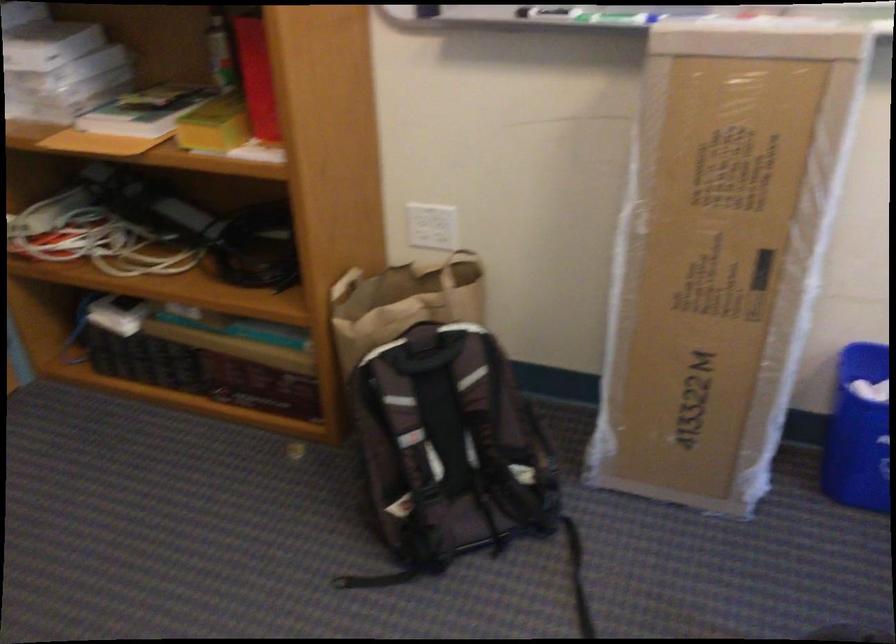
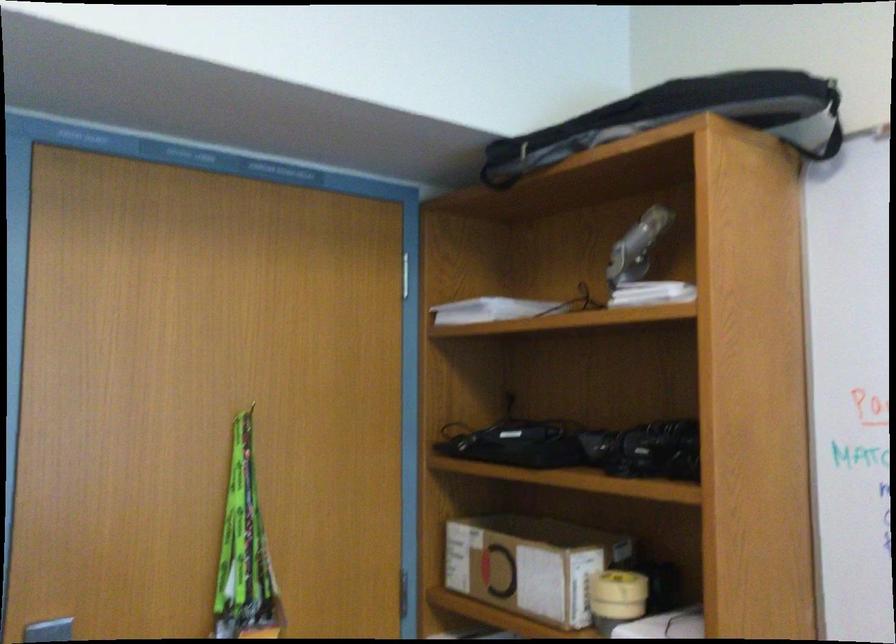
First-person continuous shooting, in which direction is the camera rotating?

The camera's rotation is toward left-up.